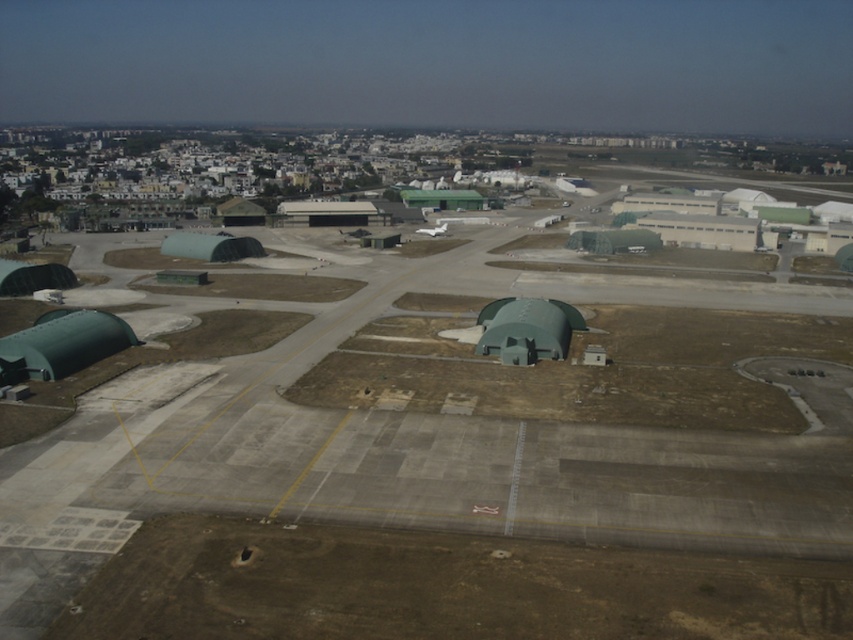
You are a drone operator tasked with landing a drone at point (9, 360) on the airbase. The drone has a maximum descent distance of 300 feet. Can the drone safely land at that point without exceeding its maximum descent distance?

The distance of point (9, 360) from viewer is 326.15 feet, which exceeds the drone maximum descent distance of 300 feet. The drone cannot safely land there.